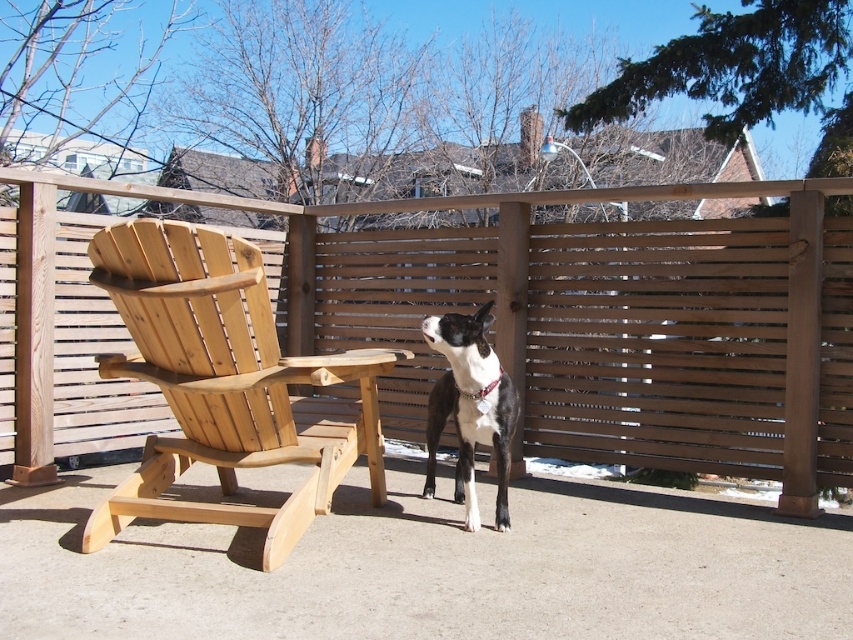
Is brown wooden fence at center smaller than light brown wood at center?

Incorrect, brown wooden fence at center is not smaller in size than light brown wood at center.

Is point (732, 404) positioned in front of point (123, 608)?

No, (732, 404) is behind (123, 608).

At what (x,y) coordinates should I click in order to perform the action: click on brown wooden fence at center. Please return your answer as a coordinate pair (x, y). The image size is (853, 640). Looking at the image, I should click on (503, 326).

Between light brown wood at center and black and white fur at center, which one is positioned lower?

Positioned lower is light brown wood at center.

Does light brown wood at center have a lesser width compared to black and white fur at center?

In fact, light brown wood at center might be wider than black and white fur at center.

Based on the photo, who is more distant from viewer, (769, 536) or (463, 392)?

The point (769, 536) is behind.

Identify the location of light brown wood at center. The image size is (853, 640). (433, 566).

Is brown wooden fence at center closer to camera compared to natural wood rocking chair at left?

No.

Does brown wooden fence at center come behind natural wood rocking chair at left?

Yes.

Find the location of `brown wooden fence at center`. brown wooden fence at center is located at coordinates (503, 326).

Find the location of a particular element. The height and width of the screenshot is (640, 853). brown wooden fence at center is located at coordinates (503, 326).